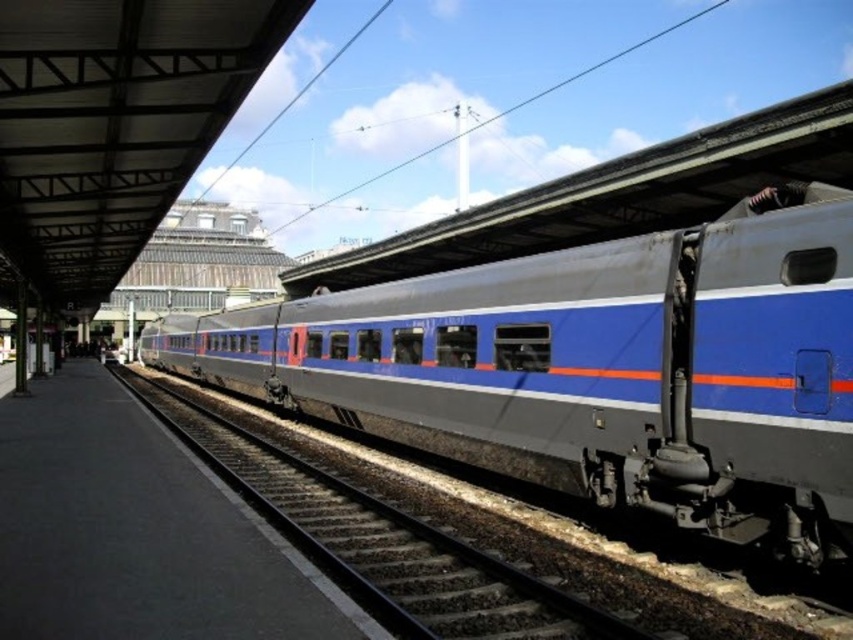
Based on the photo, does metallic blue train at center have a lesser height compared to metal train track at center?

No.

Which is in front, point (708, 269) or point (395, 586)?

Point (395, 586) is more forward.

Identify the location of metallic blue train at center. (595, 369).

The height and width of the screenshot is (640, 853). What are the coordinates of `metallic blue train at center` in the screenshot? It's located at (595, 369).